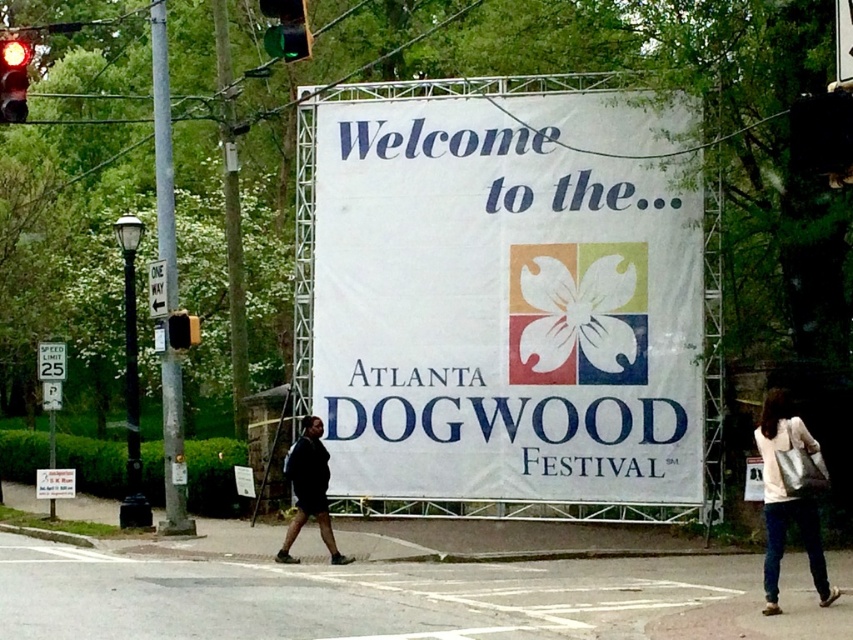
As you look at the scene of the Atlanta Dogwood Festival entrance, you notice a white leather bag at lower right and a red glass traffic light at upper left. Which object is positioned more to the east if the festival entrance faces north?

The white leather bag at lower right is positioned to the right of the red glass traffic light at upper left. Since the festival entrance faces north, the right side corresponds to east. Therefore, the white leather bag at lower right is more to the east.

You are a pedestrian standing at the entrance of the Atlanta Dogwood Festival. You see a white leather bag at lower right and a red glass traffic light at upper left. Which object is located lower in the image?

The white leather bag at lower right is located lower in the image than the red glass traffic light at upper left.

You are a pedestrian standing at the crosswalk. You see the white fabric banner at center and the green plastic one way sign at upper center. How far apart are these two objects?

The distance between the white fabric banner at center and the green plastic one way sign at upper center is 7.93 feet.